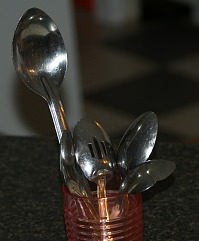
Identify the location of spoon. (49, 45), (134, 159), (143, 175), (67, 172), (93, 168).